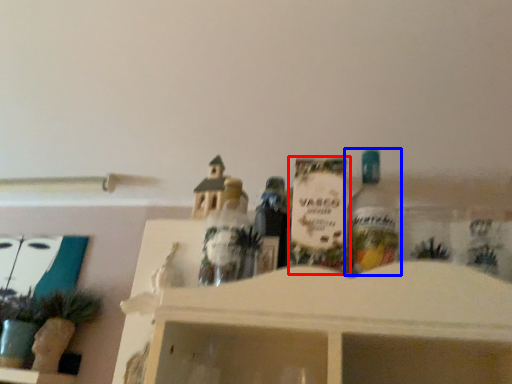
Question: Among these objects, which one is farthest to the camera, toy (highlighted by a red box) or bottle (highlighted by a blue box)?

Choices:
 (A) toy
 (B) bottle

Answer: (A)